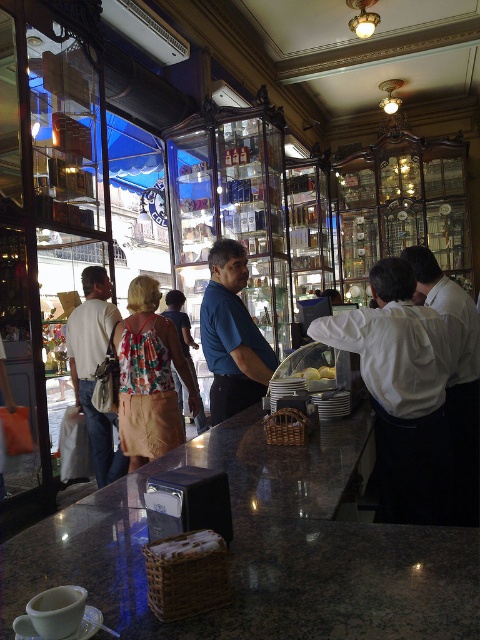
Question: Which point is closer to the camera taking this photo?

Choices:
 (A) (452, 413)
 (B) (188, 332)

Answer: (A)

Question: Which is farther from the yellow cake at center?

Choices:
 (A) blue smooth shirt at center
 (B) floral fabric dress at center
 (C) white shirt at counter

Answer: (B)

Question: Can you confirm if granite countertop at center is smaller than white shirt at counter?

Choices:
 (A) no
 (B) yes

Answer: (A)

Question: Does granite countertop at center come in front of white shirt at counter?

Choices:
 (A) yes
 (B) no

Answer: (A)

Question: Is white shirt at counter to the left of floral fabric top at center from the viewer's perspective?

Choices:
 (A) no
 (B) yes

Answer: (A)

Question: Which is nearer to the floral fabric dress at center?

Choices:
 (A) yellow cake at center
 (B) granite countertop at center

Answer: (A)